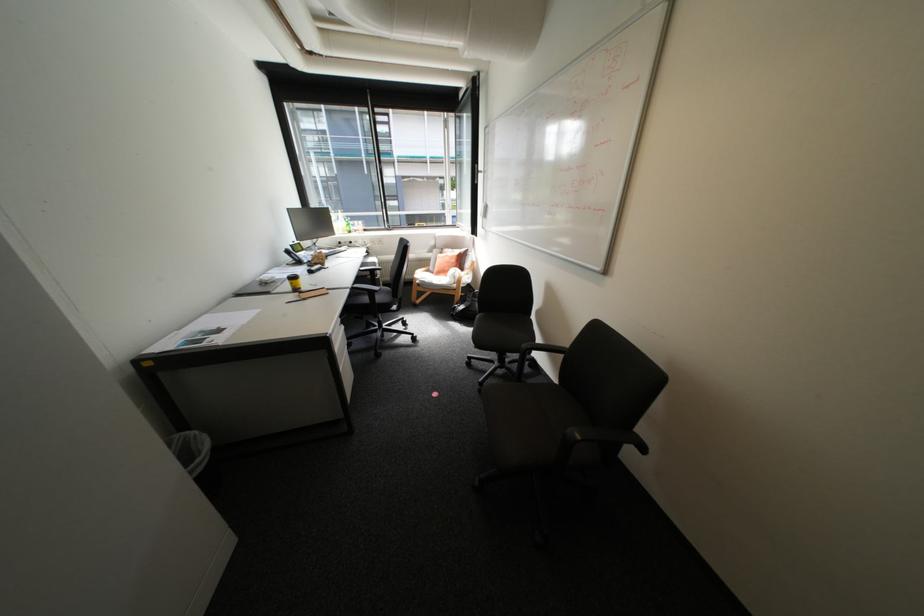
Locate an element on the screen. This screenshot has height=616, width=924. black window handle is located at coordinates (473, 174).